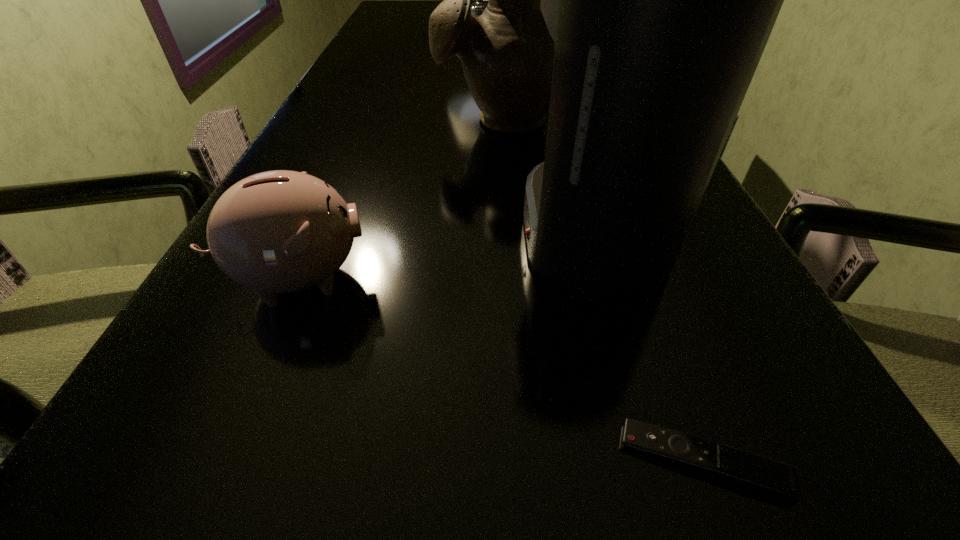
Identify the location of vacant area situated on the button side of the coffee maker. Image resolution: width=960 pixels, height=540 pixels. point(303,233).

Locate an element on the screen. The image size is (960, 540). vacant space located on the button side of the coffee maker is located at coordinates (x=394, y=233).

Locate an element on the screen. vacant area situated 0.160m at the spout of the second farthest object is located at coordinates (509, 187).

The height and width of the screenshot is (540, 960). I want to click on vacant region located on the back of the leftmost object, so click(x=327, y=210).

This screenshot has height=540, width=960. What are the coordinates of `free space located on the back of the shortest object` in the screenshot? It's located at (660, 339).

This screenshot has height=540, width=960. In order to click on object that is positioned at the far edge in this screenshot , I will do `click(477, 8)`.

The height and width of the screenshot is (540, 960). Find the location of `object positioned at the near edge`. object positioned at the near edge is located at coordinates (759, 473).

At what (x,y) coordinates should I click in order to perform the action: click on object present at the left edge. Please return your answer as a coordinate pair (x, y). Looking at the image, I should click on pos(276,232).

The image size is (960, 540). In order to click on coffee maker that is at the right edge in this screenshot , I will do `click(660, 0)`.

Where is `remote control at the right edge`? This screenshot has width=960, height=540. remote control at the right edge is located at coordinates (759, 473).